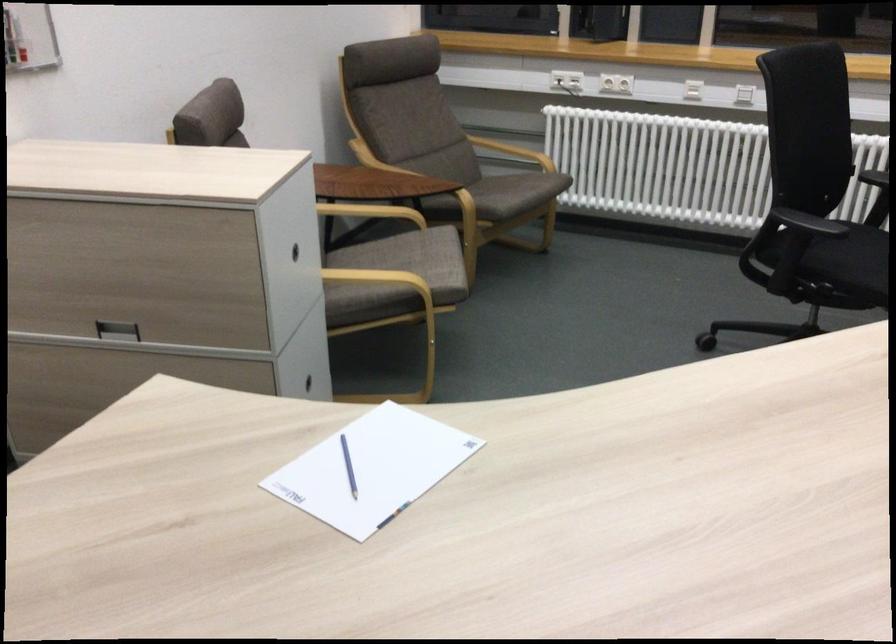
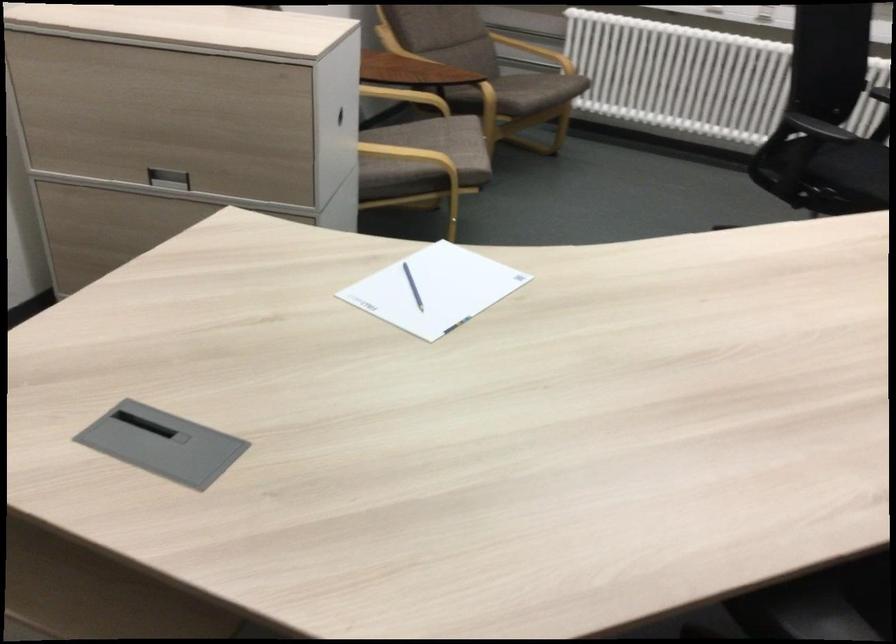
From the picture: In a continuous first-person perspective shot, in which direction is the camera moving?

The movement direction of the cameraman is left, backward.